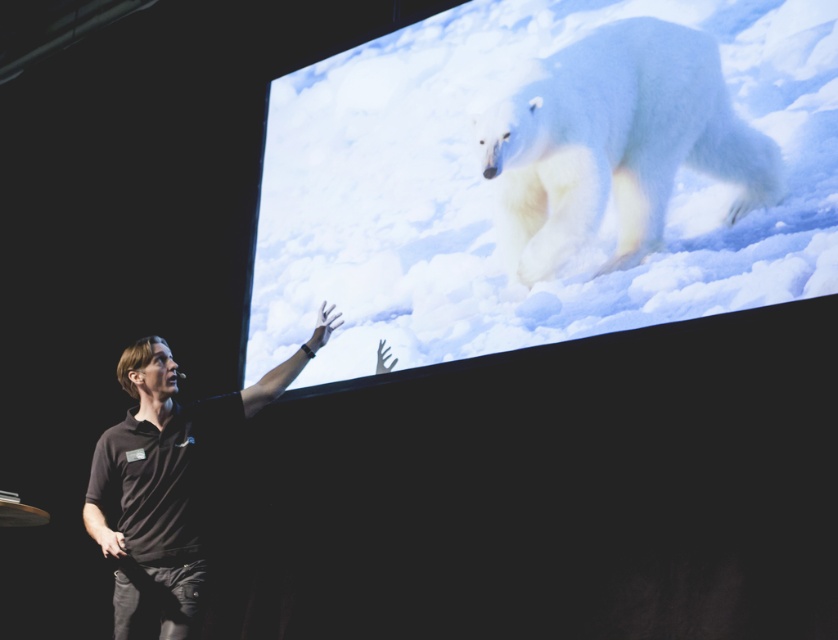
Based on the scene description, which object is wider, the white fluffy polar bear at upper right or the black cotton shirt at lower left?

The white fluffy polar bear at upper right is wider than the black cotton shirt at lower left according to the description.

Based on the scene description, which polar bear, the white fur polar bear at upper center or the white fluffy polar bear at upper right, is positioned lower in the image?

The white fur polar bear at upper center is positioned lower in the image than the white fluffy polar bear at upper right.

You are an attendee at this presentation. You notice both the white fluffy polar bear at upper right and the black cotton shirt at lower left in the image. Which object appears taller in the scene?

The black cotton shirt at lower left is taller than the white fluffy polar bear at upper right.